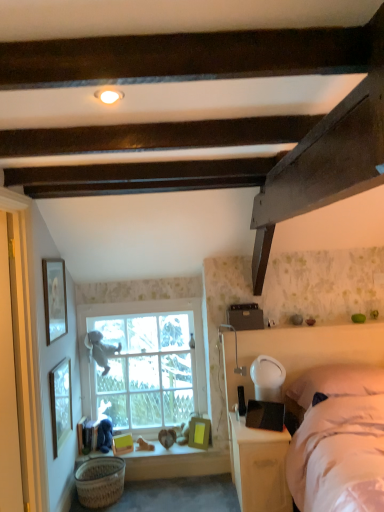
Question: Is woven brown basket at lower left wider or thinner than matte white picture frame at upper left, the first picture frame positioned from the left?

Choices:
 (A) wide
 (B) thin

Answer: (A)

Question: From the image's perspective, is woven brown basket at lower left above or below matte white picture frame at upper left, which is the fifth picture frame from right to left?

Choices:
 (A) below
 (B) above

Answer: (A)

Question: Which object is the closest to the matte white picture frame at upper left, which is the fifth picture frame from right to left?

Choices:
 (A) matte gold picture frame at lower center, which appears as the third picture frame when viewed from the top
 (B) woven brown basket at lower left
 (C) velvety blue teddy bear at lower left, which ranks as the second person in top-to-bottom order
 (D) white soft pillow at right
 (E) gray plush toy at window, positioned as the first person in top-to-bottom order

Answer: (E)

Question: Based on their relative distances, which object is nearer to the wooden window sill at lower center?

Choices:
 (A) velvety blue teddy bear at lower left, which ranks as the second person in top-to-bottom order
 (B) woven brown basket at lower left
 (C) white soft pillow at right
 (D) gray plush toy at window, positioned as the first person in top-to-bottom order
 (E) matte gold picture frame at lower center, the 5th picture frame in the left-to-right sequence

Answer: (E)